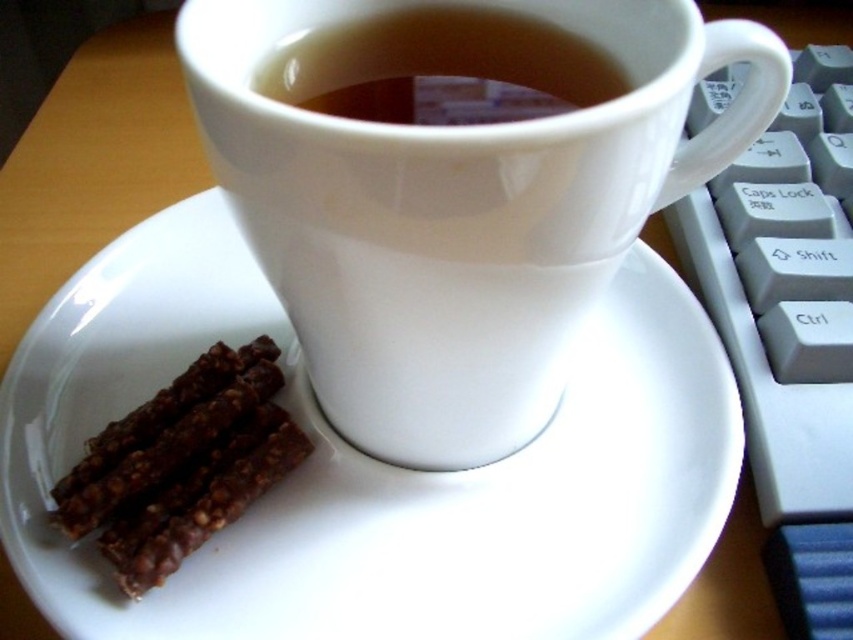
You are taking a photo of a cup and snacks on a desk. You notice two points in the image labeled as point (x=567, y=464) and point (x=303, y=68). Which point is closer to the camera?

Point (x=567, y=464) is further to the camera than point (x=303, y=68), so the closer point to the camera is point (x=303, y=68).

You are a barista preparing a drink and need to place the white ceramic mug at center and the chocolatecrumblychocolate cake at lower left on a shelf. The shelf has a height limit of 10 cm. Can both items fit vertically without exceeding the height limit?

The white ceramic mug at center is taller than the chocolatecrumblychocolate cake at lower left. However, the exact heights are not provided, so we cannot determine if both will fit within the 10 cm height limit without additional information.

You are organizing a snack bar for a small event and have the chocolatecrumblychocolate cake at lower left and the brown matte cup at upper center. If you need to stack items vertically, which item should you place at the bottom to ensure stability?

The chocolatecrumblychocolate cake at lower left should be placed at the bottom because it is much taller than the brown matte cup at upper center, providing a stable base.